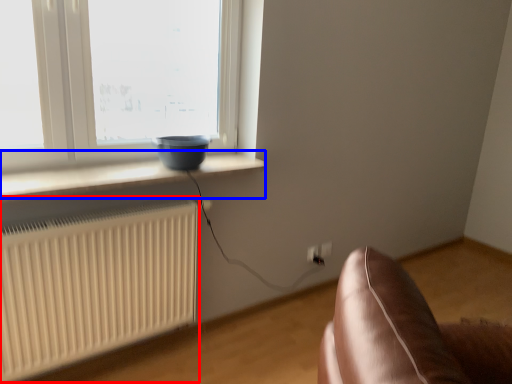
Question: Which object is closer to the camera taking this photo, radiator (highlighted by a red box) or window sill (highlighted by a blue box)?

Choices:
 (A) radiator
 (B) window sill

Answer: (A)